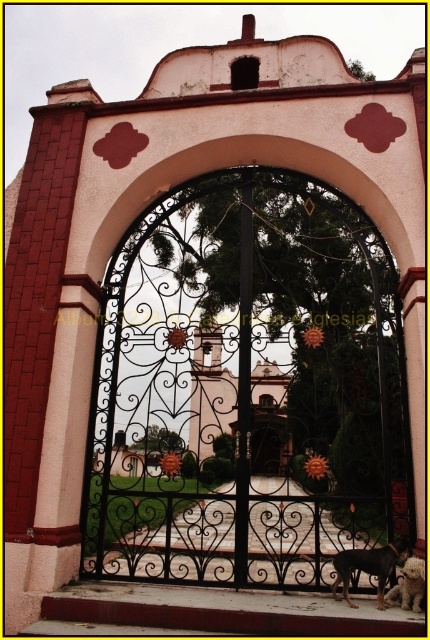
You are a visitor approaching the grand entrance gate. You see a brown fur dog at center and a white fluffy dog at lower right. Which dog is closer to the entrance gate?

The brown fur dog at center is closer to the entrance gate because it is positioned to the left of the white fluffy dog at lower right, and since both are within the gate area, the left side placement suggests proximity to the entrance.

You are a visitor approaching the grand entrance gate. You see the black wrought iron gate at center and the brown fur dog at center. Which object is taller?

The black wrought iron gate at center is taller than the brown fur dog at center.